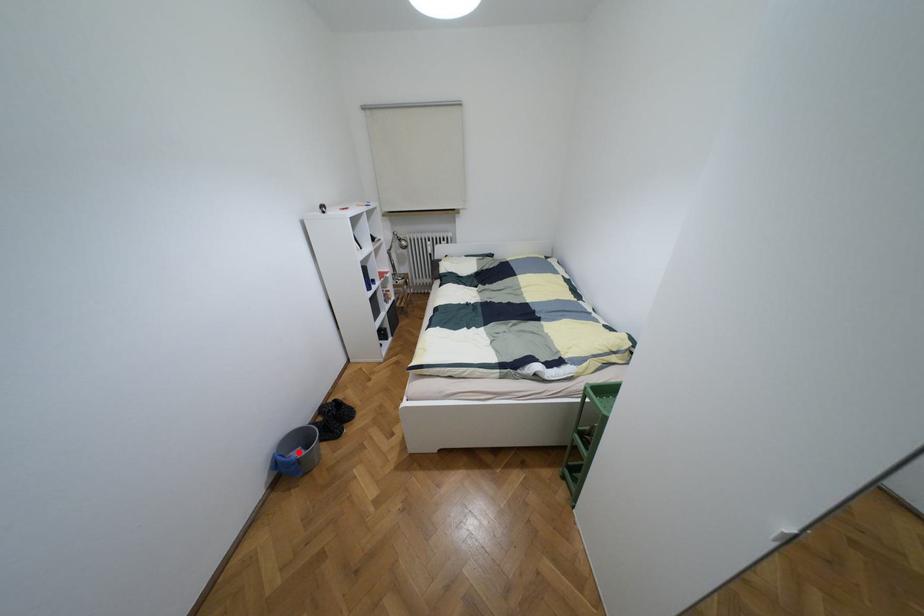
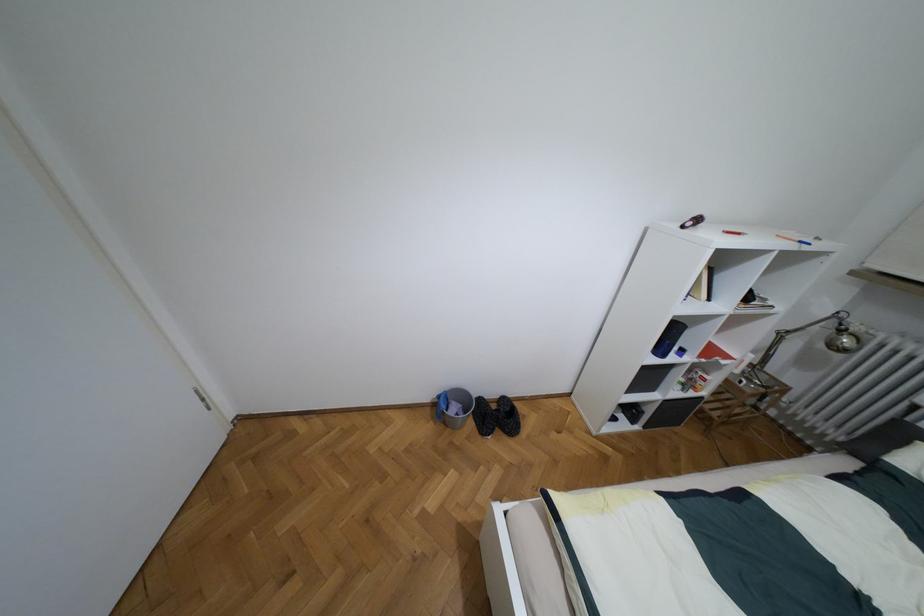
Where in the second image is the point corresponding to the highlighted location from the first image?

(453, 408)